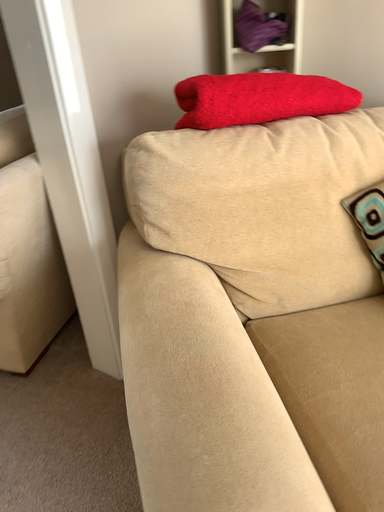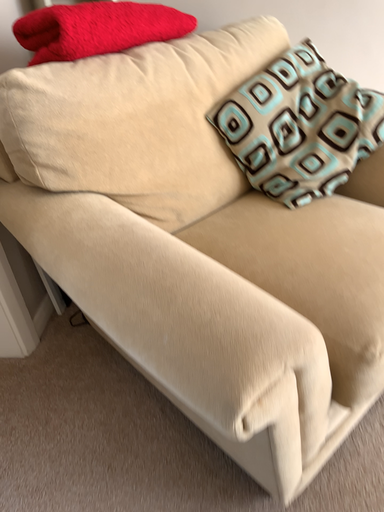
Question: How did the camera likely rotate when shooting the video?

Choices:
 (A) rotated left
 (B) rotated right

Answer: (B)